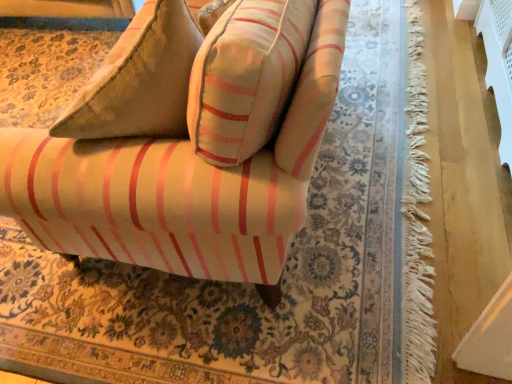
I want to click on velvet beige chair at center, so click(x=187, y=144).

What do you see at coordinates (187, 144) in the screenshot? I see `velvet beige chair at center` at bounding box center [187, 144].

You are a GUI agent. You are given a task and a screenshot of the screen. Output one action in this format:
    pyautogui.click(x=<x>, y=<y>)
    Task: Click on the velvet beige chair at center
    
    Given the screenshot: What is the action you would take?
    pyautogui.click(x=187, y=144)